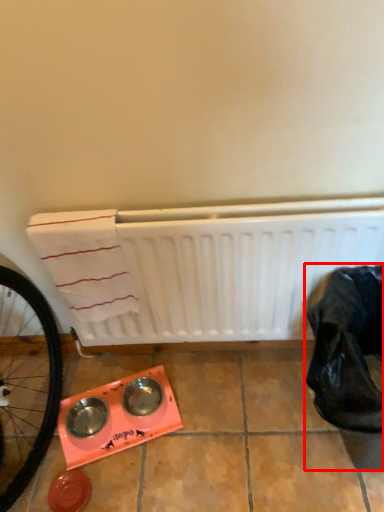
Question: From the image, what is the correct spatial relationship of waste (annotated by the red box) in relation to water heater?

Choices:
 (A) left
 (B) right

Answer: (B)